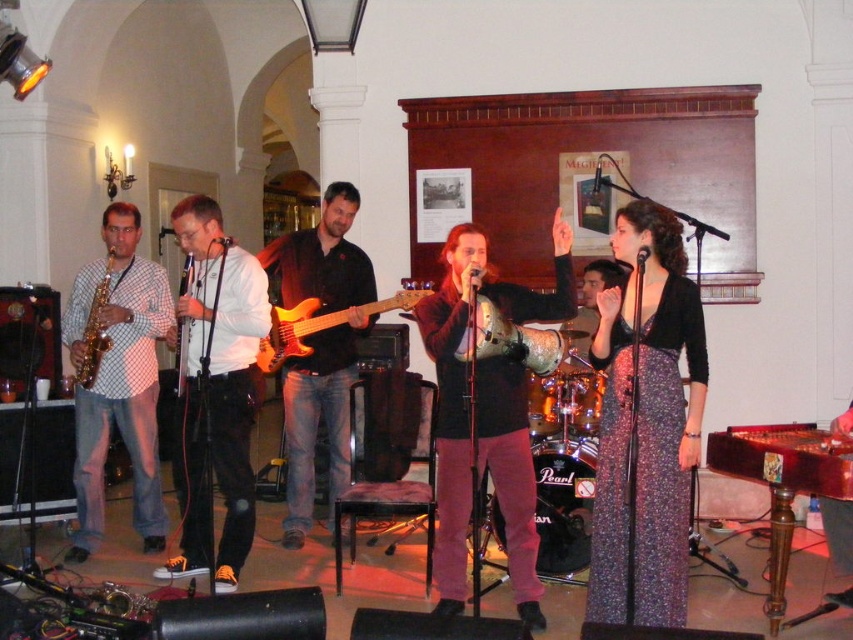
Between metallic silver tambourine at center and gold metallic saxophone at left, which one appears on the left side from the viewer's perspective?

From the viewer's perspective, gold metallic saxophone at left appears more on the left side.

Between metallic silver tambourine at center and gold metallic saxophone at left, which one has more height?

With more height is metallic silver tambourine at center.

Is point (529, 467) positioned after point (74, 365)?

No.

Identify the location of metallic silver tambourine at center. The width and height of the screenshot is (853, 640). (466, 378).

Does matte black saxophone at left appear on the right side of brown leather guitar at center?

Indeed, matte black saxophone at left is positioned on the right side of brown leather guitar at center.

Which of these two, matte black saxophone at left or brown leather guitar at center, stands taller?

brown leather guitar at center

Where is `matte black saxophone at left`? Image resolution: width=853 pixels, height=640 pixels. matte black saxophone at left is located at coordinates click(x=659, y=390).

Between printed fabric dress at center and metallic silver tambourine at center, which one has more height?

With more height is metallic silver tambourine at center.

Locate an element on the screen. printed fabric dress at center is located at coordinates (646, 422).

The image size is (853, 640). In order to click on printed fabric dress at center in this screenshot , I will do `click(646, 422)`.